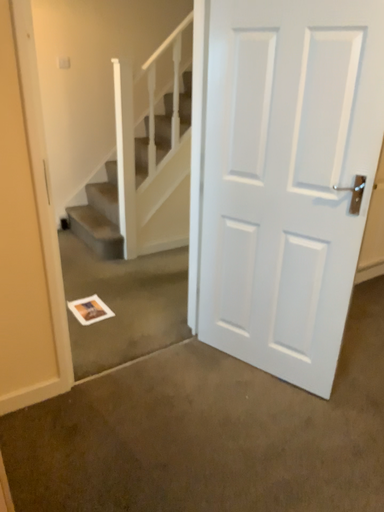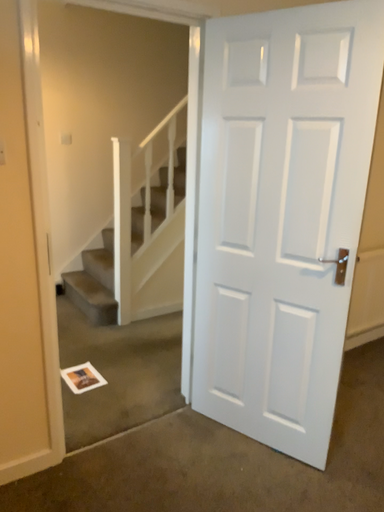
Question: How did the camera likely rotate when shooting the video?

Choices:
 (A) rotated upward
 (B) rotated downward

Answer: (A)